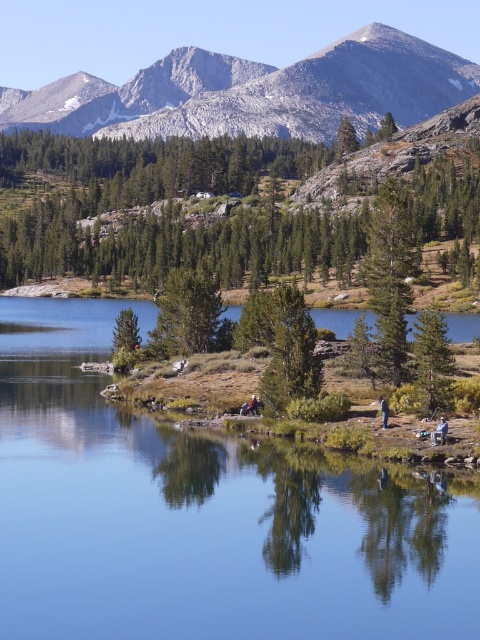
Can you confirm if green matte tree at center-right is positioned to the right of blue denim jacket at lower right?

Yes, green matte tree at center-right is to the right of blue denim jacket at lower right.

Who is higher up, green matte tree at center-right or blue denim jacket at lower right?

Result: Positioned higher is green matte tree at center-right.

Find the location of `green matte tree at center-right`. green matte tree at center-right is located at coordinates (391, 276).

Is smooth reflective water at center bigger than gray rocky mountain at upper center?

Incorrect, smooth reflective water at center is not larger than gray rocky mountain at upper center.

The height and width of the screenshot is (640, 480). Describe the element at coordinates (204, 515) in the screenshot. I see `smooth reflective water at center` at that location.

Identify the location of smooth reflective water at center. (204, 515).

Is green matte tree at upper center positioned behind green matte tree at center?

No, green matte tree at upper center is closer to the viewer.

Which is in front, point (119, 262) or point (192, 349)?

Point (192, 349)

You are a GUI agent. You are given a task and a screenshot of the screen. Output one action in this format:
    pyautogui.click(x=<x>, y=<y>)
    Task: Click on the green matte tree at upper center
    The height and width of the screenshot is (640, 480).
    Given the screenshot: What is the action you would take?
    pos(167,211)